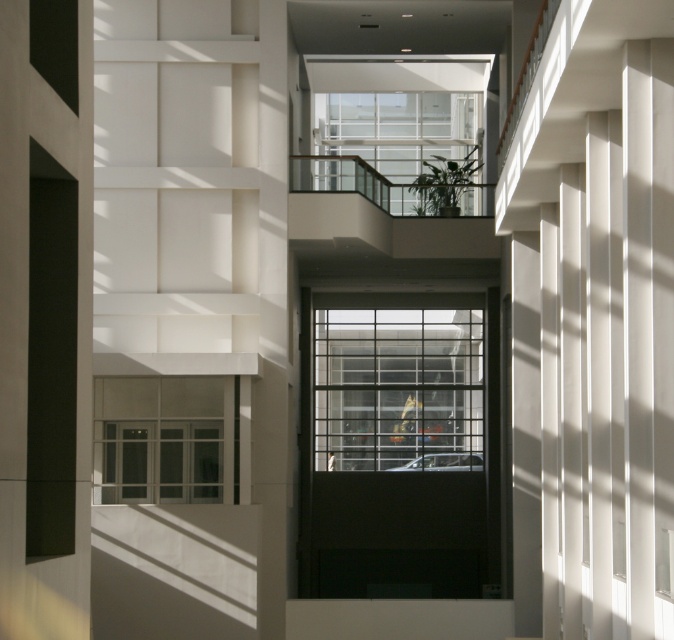
Question: In this image, where is clear glass window at center located relative to clear glass window at upper center?

Choices:
 (A) left
 (B) right

Answer: (B)

Question: Can you confirm if clear glass window at center is positioned to the left of clear glass window at lower center?

Choices:
 (A) no
 (B) yes

Answer: (A)

Question: Where is clear glass window at center located in relation to clear glass window at upper center in the image?

Choices:
 (A) right
 (B) left

Answer: (A)

Question: Among these objects, which one is nearest to the camera?

Choices:
 (A) clear glass window at center
 (B) clear glass window at upper center
 (C) clear glass window at lower center

Answer: (C)

Question: Which object is farther from the camera taking this photo?

Choices:
 (A) clear glass window at lower center
 (B) clear glass window at center

Answer: (B)

Question: Which of the following is the farthest from the observer?

Choices:
 (A) (195, 496)
 (B) (437, 202)
 (C) (321, 330)

Answer: (C)